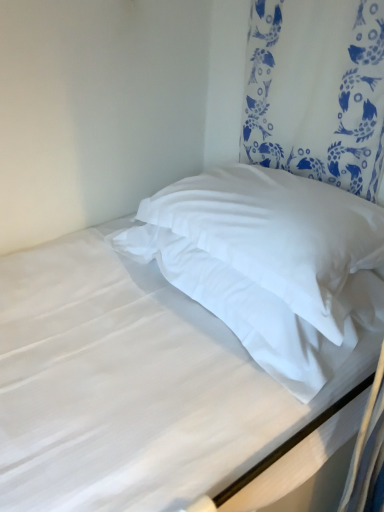
I want to click on white fabric curtain at upper right, so click(316, 91).

In order to face white fabric curtain at upper right, should I rotate leftwards or rightwards?

To face it directly, rotate right by 15.211 degrees.

Locate an element on the screen. white soft pillow at center, which appears as the 2th pillow when ordered from the bottom is located at coordinates (277, 233).

At what (x,y) coordinates should I click in order to perform the action: click on white fabric curtain at upper right. Please return your answer as a coordinate pair (x, y). This screenshot has width=384, height=512. Looking at the image, I should click on (316, 91).

Is white soft pillow at center, which appears as the 2th pillow when ordered from the bottom, touching white soft pillow at center, the second pillow positioned from the top?

white soft pillow at center, which appears as the 2th pillow when ordered from the bottom, and white soft pillow at center, the second pillow positioned from the top, are clearly separated.

From a real-world perspective, is white soft pillow at center, positioned as the 1th pillow in top-to-bottom order, over white soft pillow at center, the second pillow positioned from the top?

Yes, from a real-world perspective, white soft pillow at center, positioned as the 1th pillow in top-to-bottom order, is on top of white soft pillow at center, the second pillow positioned from the top.

Can you confirm if white soft pillow at center, positioned as the 1th pillow in top-to-bottom order, is shorter than white soft pillow at center, which is the first pillow from bottom to top?

No.

Considering the positions of objects white soft pillow at center, which appears as the 2th pillow when ordered from the bottom, and white soft pillow at center, the second pillow positioned from the top, in the image provided, who is more to the left, white soft pillow at center, which appears as the 2th pillow when ordered from the bottom, or white soft pillow at center, the second pillow positioned from the top,?

white soft pillow at center, the second pillow positioned from the top.

Is white soft pillow at center, positioned as the 1th pillow in top-to-bottom order, in front of or behind white fabric curtain at upper right in the image?

Clearly, white soft pillow at center, positioned as the 1th pillow in top-to-bottom order, is in front of white fabric curtain at upper right.

Where is `curtain above the white soft pillow at center, which appears as the 2th pillow when ordered from the bottom (from a real-world perspective)`? This screenshot has height=512, width=384. curtain above the white soft pillow at center, which appears as the 2th pillow when ordered from the bottom (from a real-world perspective) is located at coordinates (316, 91).

Is point (324, 285) closer to viewer compared to point (299, 143)?

Yes, point (324, 285) is in front of point (299, 143).

Which of these two, white soft pillow at center, which appears as the 2th pillow when ordered from the bottom, or white fabric curtain at upper right, is wider?

white soft pillow at center, which appears as the 2th pillow when ordered from the bottom.

From their relative heights in the image, would you say white fabric curtain at upper right is taller or shorter than white soft pillow at center, the second pillow positioned from the top?

Considering their sizes, white fabric curtain at upper right has more height than white soft pillow at center, the second pillow positioned from the top.

Is white fabric curtain at upper right inside or outside of white soft pillow at center, which is the first pillow from bottom to top?

white fabric curtain at upper right is spatially situated outside white soft pillow at center, which is the first pillow from bottom to top.

Is white fabric curtain at upper right positioned far away from white soft pillow at center, which is the first pillow from bottom to top?

No, white fabric curtain at upper right is not far from white soft pillow at center, which is the first pillow from bottom to top.

Considering their positions, is white fabric curtain at upper right located in front of or behind white soft pillow at center, which is the first pillow from bottom to top?

white fabric curtain at upper right is in front of white soft pillow at center, which is the first pillow from bottom to top.

Is point (306, 179) positioned before point (298, 13)?

No, it is not.

Is white smooth pillow at upper right beside white fabric curtain at upper right?

There is a gap between white smooth pillow at upper right and white fabric curtain at upper right.

Is white smooth pillow at upper right to the left of white fabric curtain at upper right from the viewer's perspective?

Indeed, white smooth pillow at upper right is positioned on the left side of white fabric curtain at upper right.

From a real-world perspective, who is located higher, white soft pillow at center, the second pillow positioned from the top, or white smooth pillow at upper right?

white soft pillow at center, the second pillow positioned from the top.

Is white soft pillow at center, the second pillow positioned from the top, not near white smooth pillow at upper right?

white soft pillow at center, the second pillow positioned from the top, is actually quite close to white smooth pillow at upper right.

From the image's perspective, is white soft pillow at center, which is the first pillow from bottom to top, under white smooth pillow at upper right?

No, from the image's perspective, white soft pillow at center, which is the first pillow from bottom to top, is not below white smooth pillow at upper right.

Locate an element on the screen. The width and height of the screenshot is (384, 512). bed in front of the white soft pillow at center, the second pillow positioned from the top is located at coordinates (182, 339).

Locate an element on the screen. The height and width of the screenshot is (512, 384). pillow that is the 1st object to the right of the white smooth pillow at upper right, starting at the anchor is located at coordinates (243, 310).

Would you say white smooth pillow at upper right is a long distance from white soft pillow at center, which is the first pillow from bottom to top?

No, white smooth pillow at upper right is not far away from white soft pillow at center, which is the first pillow from bottom to top.

Is white smooth pillow at upper right looking in the opposite direction of white soft pillow at center, which is the first pillow from bottom to top?

No, white smooth pillow at upper right is not facing away from white soft pillow at center, which is the first pillow from bottom to top.

Is white smooth pillow at upper right further to the viewer compared to white soft pillow at center, which is the first pillow from bottom to top?

No, it is in front of white soft pillow at center, which is the first pillow from bottom to top.

Considering the sizes of objects white soft pillow at center, which appears as the 2th pillow when ordered from the bottom, and white smooth pillow at upper right in the image provided, who is taller, white soft pillow at center, which appears as the 2th pillow when ordered from the bottom, or white smooth pillow at upper right?

white smooth pillow at upper right.

From the image's perspective, which one is positioned higher, white soft pillow at center, which appears as the 2th pillow when ordered from the bottom, or white smooth pillow at upper right?

From the image's view, white soft pillow at center, which appears as the 2th pillow when ordered from the bottom, is above.

Which is behind, point (323, 282) or point (258, 354)?

Positioned behind is point (258, 354).

Is white soft pillow at center, which appears as the 2th pillow when ordered from the bottom, inside the boundaries of white smooth pillow at upper right, or outside?

white soft pillow at center, which appears as the 2th pillow when ordered from the bottom, lies outside white smooth pillow at upper right.

I want to click on pillow to the left of white soft pillow at center, which appears as the 2th pillow when ordered from the bottom, so click(243, 310).

Where is `curtain above the white soft pillow at center, which appears as the 2th pillow when ordered from the bottom (from a real-world perspective)`? The width and height of the screenshot is (384, 512). curtain above the white soft pillow at center, which appears as the 2th pillow when ordered from the bottom (from a real-world perspective) is located at coordinates (316, 91).

Considering their positions, is white soft pillow at center, which is the first pillow from bottom to top, positioned closer to white fabric curtain at upper right than white soft pillow at center, which appears as the 2th pillow when ordered from the bottom?

Among the two, white soft pillow at center, which appears as the 2th pillow when ordered from the bottom, is located nearer to white fabric curtain at upper right.

When comparing their distances from white soft pillow at center, positioned as the 1th pillow in top-to-bottom order, does white smooth pillow at upper right or white fabric curtain at upper right seem closer?

Among the two, white smooth pillow at upper right is located nearer to white soft pillow at center, positioned as the 1th pillow in top-to-bottom order.

From the image, which object appears to be nearer to white smooth pillow at upper right, white soft pillow at center, which appears as the 2th pillow when ordered from the bottom, or white soft pillow at center, the second pillow positioned from the top?

Based on the image, white soft pillow at center, which appears as the 2th pillow when ordered from the bottom, appears to be nearer to white smooth pillow at upper right.

From the image, which object appears to be farther from white fabric curtain at upper right, white smooth pillow at upper right or white soft pillow at center, which is the first pillow from bottom to top?

white soft pillow at center, which is the first pillow from bottom to top.

Based on their spatial positions, is white soft pillow at center, the second pillow positioned from the top, or white fabric curtain at upper right closer to white smooth pillow at upper right?

white soft pillow at center, the second pillow positioned from the top, is closer to white smooth pillow at upper right.

From the image, which object appears to be nearer to white soft pillow at center, which is the first pillow from bottom to top, white smooth pillow at upper right or white soft pillow at center, positioned as the 1th pillow in top-to-bottom order?

white soft pillow at center, positioned as the 1th pillow in top-to-bottom order, is closer to white soft pillow at center, which is the first pillow from bottom to top.

Which object lies further to the anchor point white soft pillow at center, positioned as the 1th pillow in top-to-bottom order, white fabric curtain at upper right or white soft pillow at center, the second pillow positioned from the top?

white fabric curtain at upper right is further to white soft pillow at center, positioned as the 1th pillow in top-to-bottom order.

Looking at the image, which one is located closer to white fabric curtain at upper right, white soft pillow at center, which appears as the 2th pillow when ordered from the bottom, or white soft pillow at center, which is the first pillow from bottom to top?

white soft pillow at center, which appears as the 2th pillow when ordered from the bottom, lies closer to white fabric curtain at upper right than the other object.

I want to click on pillow between white soft pillow at center, positioned as the 1th pillow in top-to-bottom order, and white smooth pillow at upper right from top to bottom, so click(x=243, y=310).

Identify the location of pillow between white fabric curtain at upper right and white soft pillow at center, which is the first pillow from bottom to top, in the vertical direction. This screenshot has width=384, height=512. (277, 233).